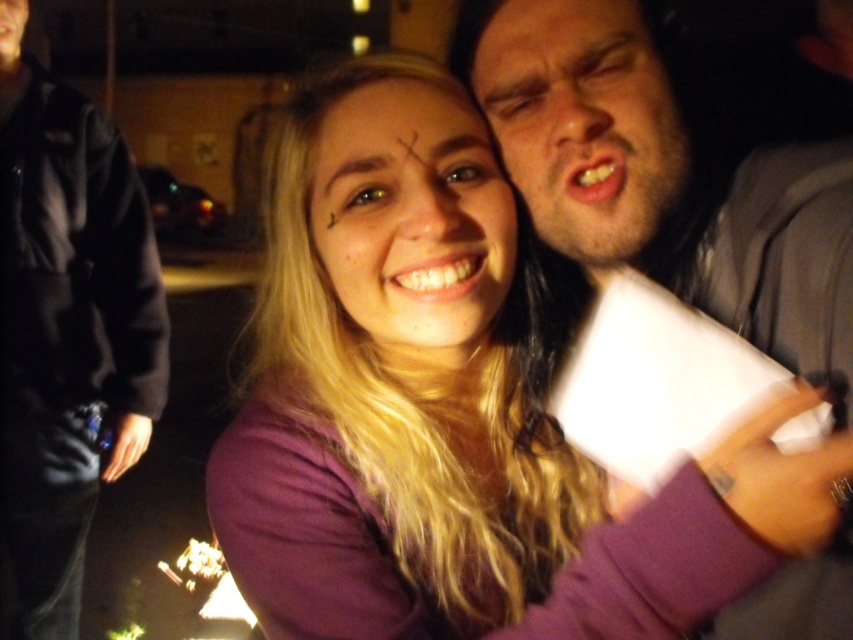
Which of these two, purple matte shirt at center or matte skin face at center, stands shorter?

With less height is matte skin face at center.

Consider the image. Which is below, purple matte shirt at center or matte skin face at center?

purple matte shirt at center

The image size is (853, 640). Describe the element at coordinates (451, 410) in the screenshot. I see `purple matte shirt at center` at that location.

Identify the location of purple matte shirt at center. (451, 410).

Does point (142, 355) come farther from viewer compared to point (618, 33)?

Yes, point (142, 355) is farther from viewer.

From the picture: Does black fleece jacket at center appear over bearded man at right?

Incorrect, black fleece jacket at center is not positioned above bearded man at right.

Is point (142, 349) positioned before point (659, 52)?

That is False.

The height and width of the screenshot is (640, 853). Find the location of `black fleece jacket at center`. black fleece jacket at center is located at coordinates (67, 326).

Is black fleece jacket at center to the left of matte skin face at center from the viewer's perspective?

Correct, you'll find black fleece jacket at center to the left of matte skin face at center.

How far apart are black fleece jacket at center and matte skin face at center?

The distance of black fleece jacket at center from matte skin face at center is 1.30 meters.

The image size is (853, 640). What do you see at coordinates (67, 326) in the screenshot? I see `black fleece jacket at center` at bounding box center [67, 326].

Find the location of a particular element. black fleece jacket at center is located at coordinates (67, 326).